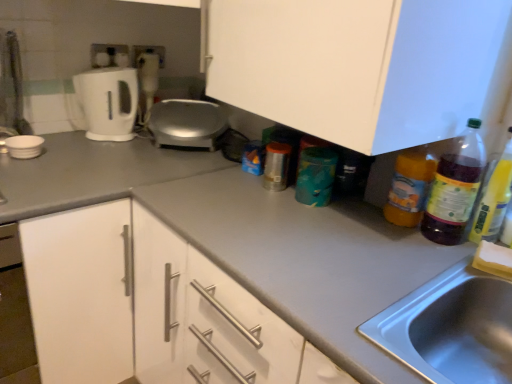
Identify the location of free space that is in between white glossy electric kettle at upper left and white matte bowl at left, which is the second appliance from right to left. (69, 142).